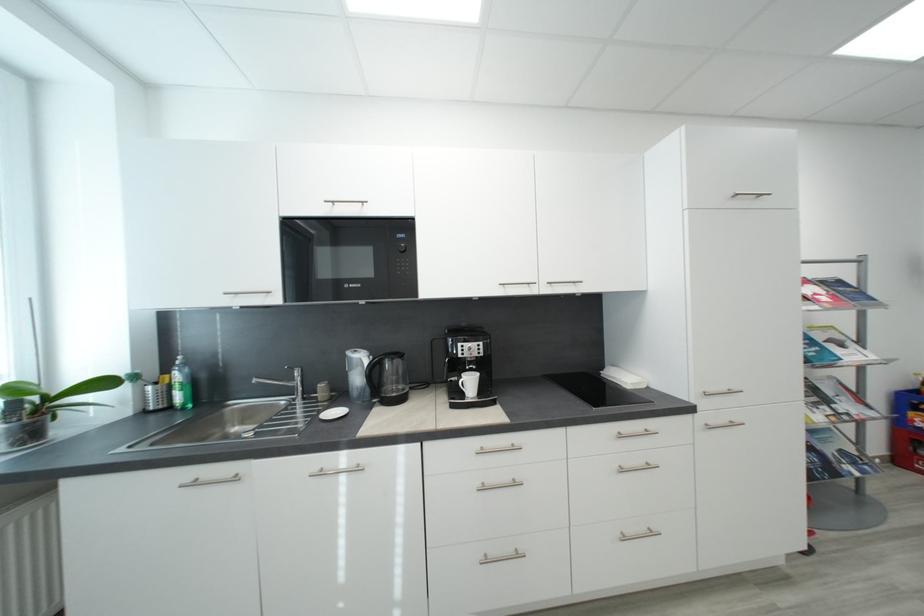
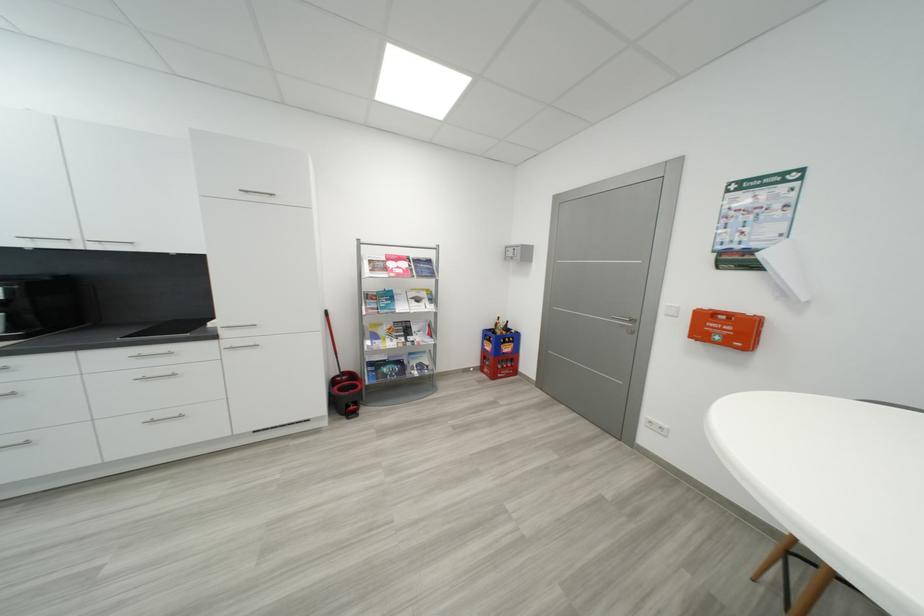
In the second image, find the point that corresponds to pixel 809 300 in the first image.

(393, 270)